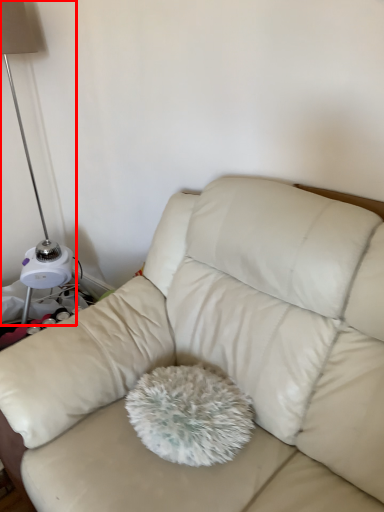
Question: From the image's perspective, considering the relative positions of lamp (annotated by the red box) and studio couch in the image provided, where is lamp (annotated by the red box) located with respect to the staircase?

Choices:
 (A) below
 (B) above

Answer: (B)